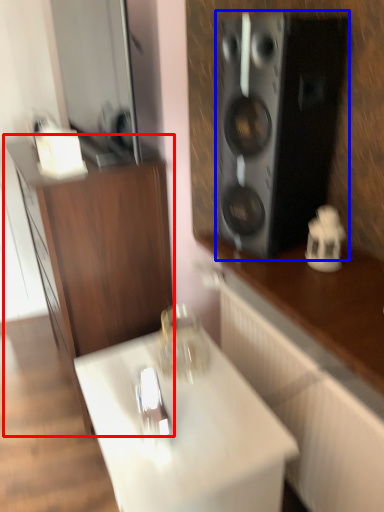
Question: Which of the following is the farthest to the observer, cabinetry (highlighted by a red box) or speaker (highlighted by a blue box)?

Choices:
 (A) cabinetry
 (B) speaker

Answer: (A)